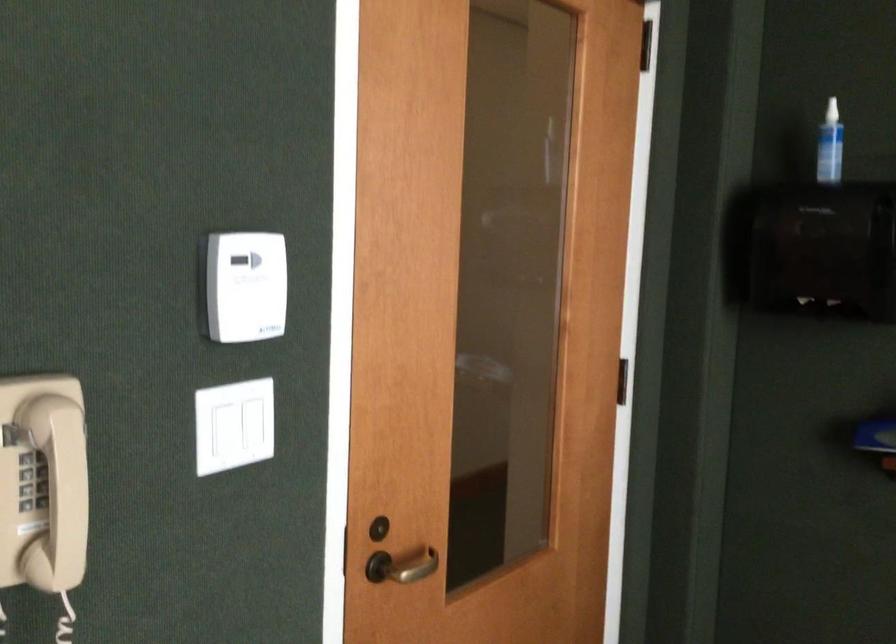
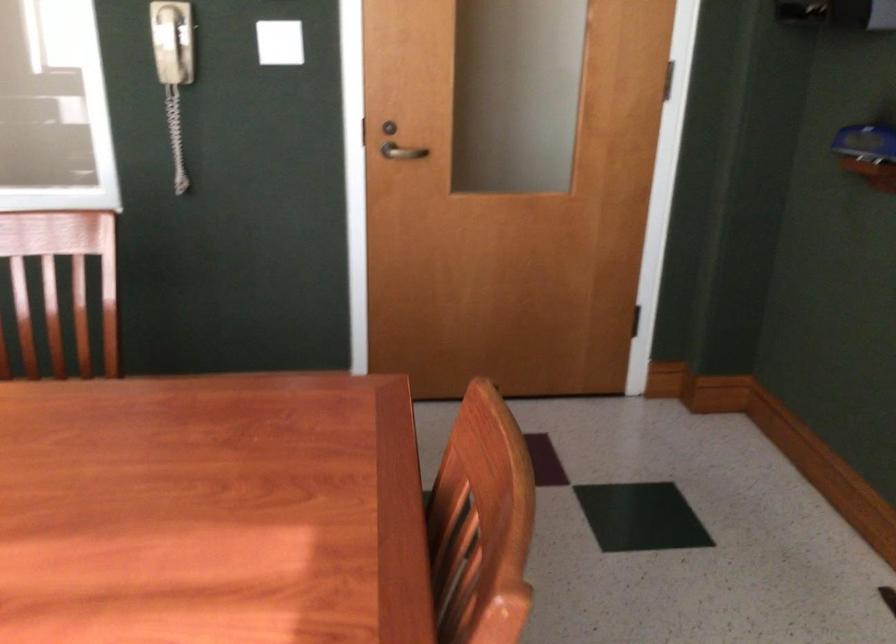
In the second image, find the point that corresponds to point (409, 569) in the first image.

(401, 152)